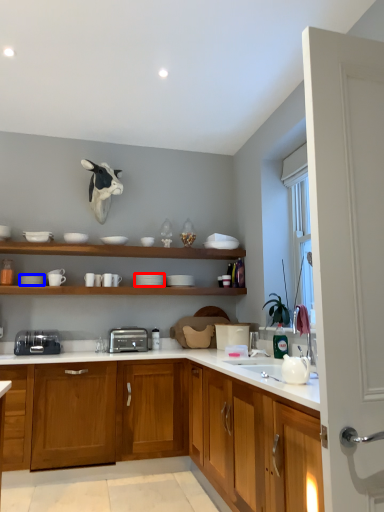
Question: Which object is closer to the camera taking this photo, tableware (highlighted by a red box) or tableware (highlighted by a blue box)?

Choices:
 (A) tableware
 (B) tableware

Answer: (B)